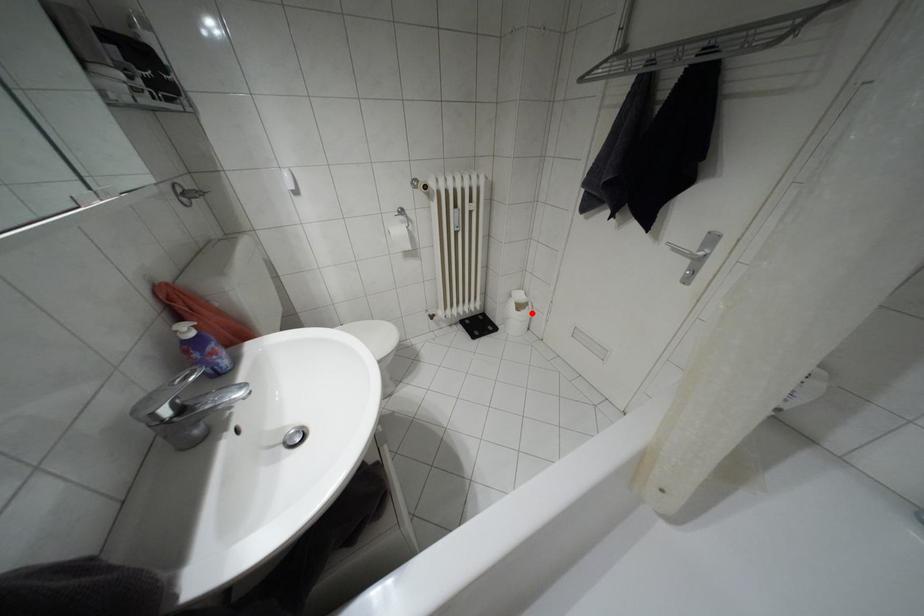
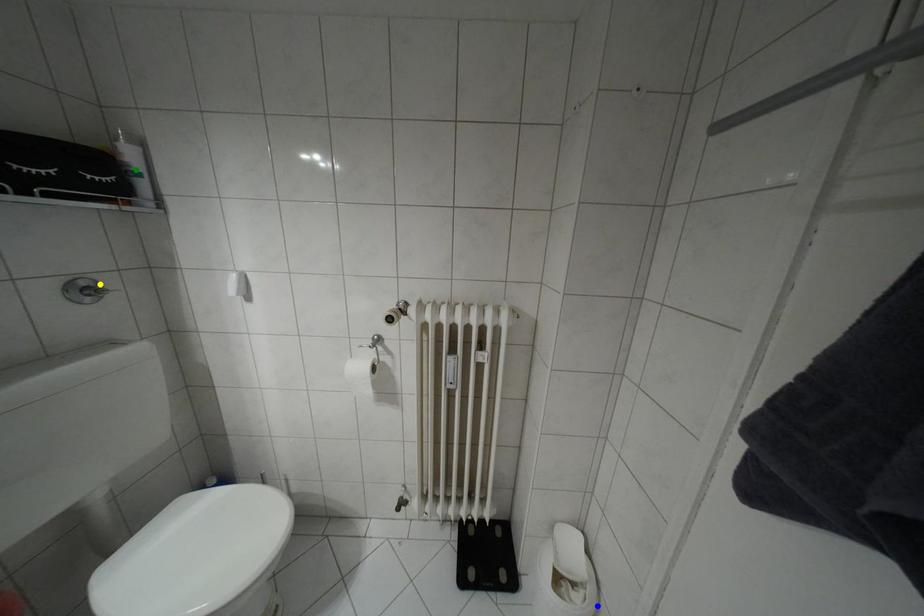
Question: I am providing you with two images of the same scene from different viewpoints. A red point is marked on the first image. You are given multiple points on the second image. Can you choose the point in image 2 that corresponds to the point in image 1?

Choices:
 (A) yellow point
 (B) green point
 (C) blue point

Answer: (C)